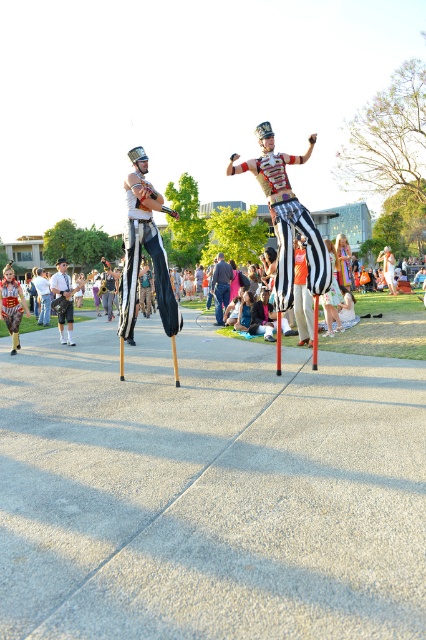
Question: Can you confirm if black striped pants at center is thinner than denim jacket at center?

Choices:
 (A) yes
 (B) no

Answer: (A)

Question: Estimate the real-world distances between objects in this image. Which object is closer to the denim jacket at center?

Choices:
 (A) striped fabric pants at center
 (B) black striped pants at center
 (C) denim pants at center

Answer: (C)

Question: Does striped fabric pants at center have a larger size compared to black striped pants at center?

Choices:
 (A) no
 (B) yes

Answer: (B)

Question: Is striped fabric pants at center above denim pants at center?

Choices:
 (A) no
 (B) yes

Answer: (B)

Question: Which is nearer to the denim jacket at center?

Choices:
 (A) denim pants at center
 (B) black striped pants at center
 (C) striped fabric pants at center

Answer: (A)

Question: Which point is farther to the camera?

Choices:
 (A) denim pants at center
 (B) black striped pants at center
 (C) striped fabric pants at center

Answer: (A)